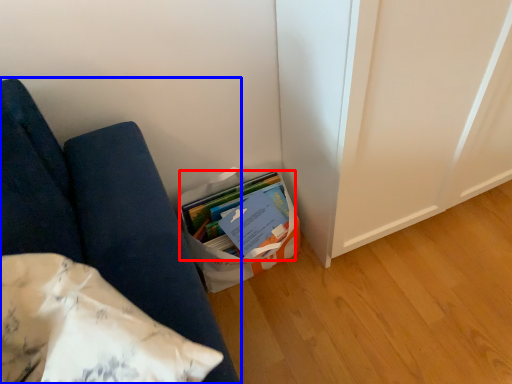
Question: Which object appears farthest to the camera in this image, book (highlighted by a red box) or furniture (highlighted by a blue box)?

Choices:
 (A) book
 (B) furniture

Answer: (A)